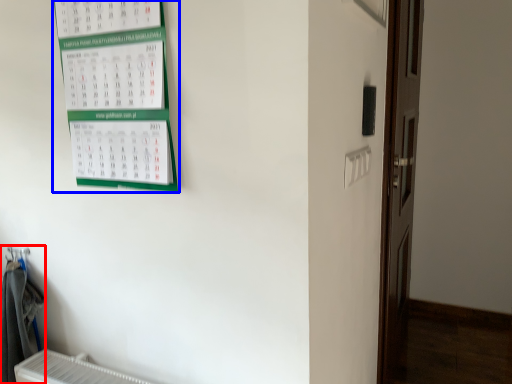
Question: Which point is further to the camera, laundry (highlighted by a red box) or bulletin board (highlighted by a blue box)?

Choices:
 (A) laundry
 (B) bulletin board

Answer: (A)